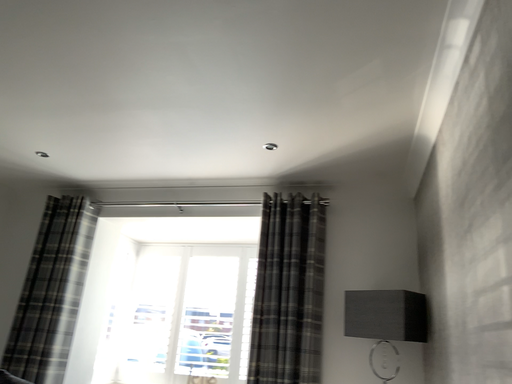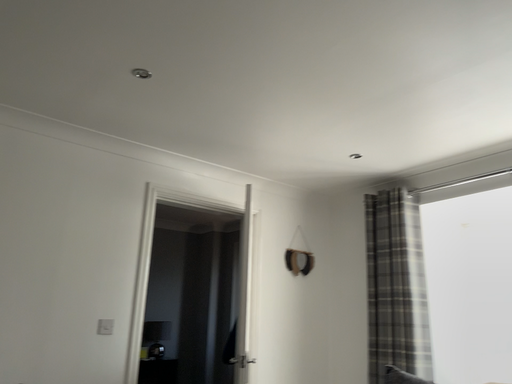
Question: How did the camera likely rotate when shooting the video?

Choices:
 (A) rotated upward
 (B) rotated downward

Answer: (B)